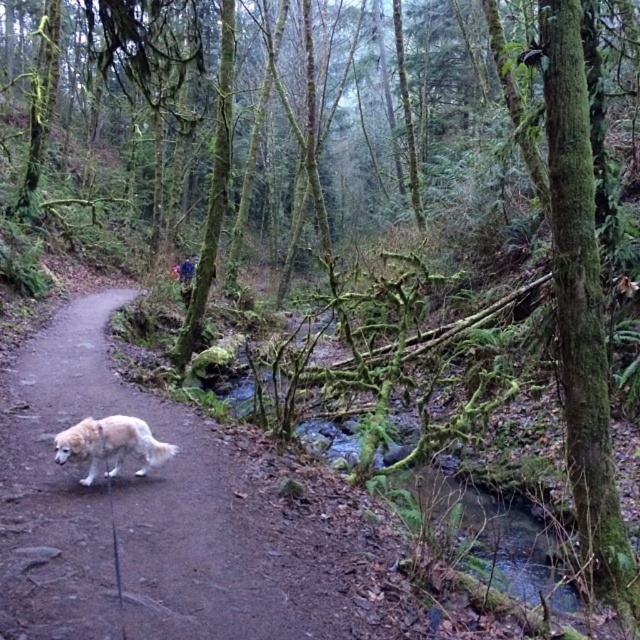
You are a hiker who wants to walk along the brown dirt path at center while keeping the white fluffy dog at lower left on your right side. Is this possible?

The brown dirt path at center is positioned on the left side of white fluffy dog at lower left. Therefore, if you walk along the brown dirt path at center, the white fluffy dog at lower left will naturally be on your right side.

You are a hiker carrying a backpack and want to walk along the brown dirt path at center while avoiding the white fluffy dog at lower left. Can you walk on the path without stepping on the dog?

The brown dirt path at center might be wider than white fluffy dog at lower left, so there is a possibility to walk on the path without stepping on the dog.

From the picture: You are a hiker who wants to walk along the brown dirt path at center. There is a white fluffy dog at lower left nearby. Can you walk on the path without stepping on the dog?

The brown dirt path at center is not as tall as the white fluffy dog at lower left, so the path is lower than the dog. Since the dog is on the ground, you can walk on the path without stepping on the dog as long as you avoid the area where the dog is located.